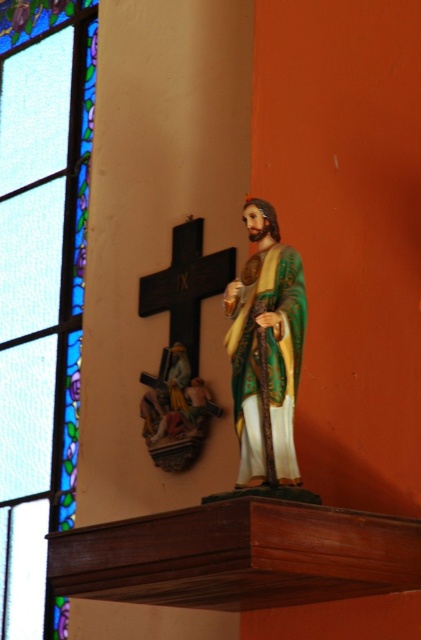
You are standing in the religious interior and want to locate the stained glass at upper left. According to the coordinates provided, where should you look relative to the statue of the saint?

The stained glass at upper left is located at coordinates point (x=40, y=285), which means it is positioned to the left and slightly above the statue of the saint.

You are standing in the religious interior and want to know how far the stained glass at upper left is from you. Can you determine the distance?

The stained glass at upper left is 58.11 meters away from you.